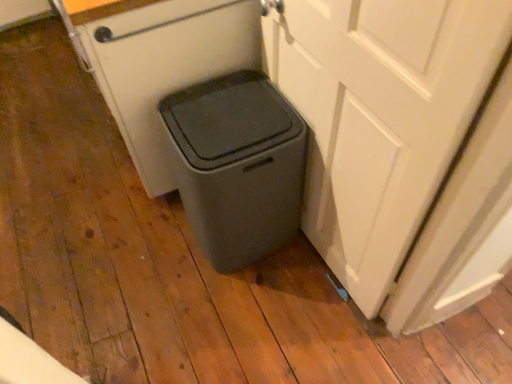
Find the location of `vacant region to the left of white matte door at right`. vacant region to the left of white matte door at right is located at coordinates (168, 291).